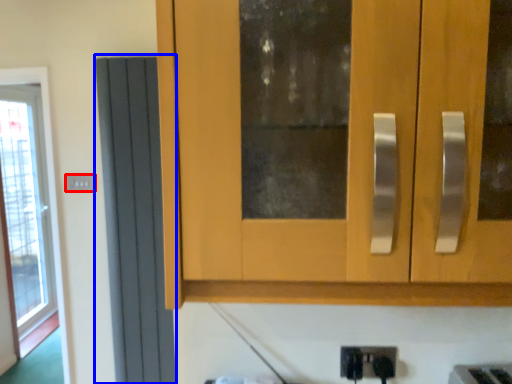
Question: Which of the following is the farthest to the observer, electric outlet (highlighted by a red box) or screen door (highlighted by a blue box)?

Choices:
 (A) electric outlet
 (B) screen door

Answer: (A)